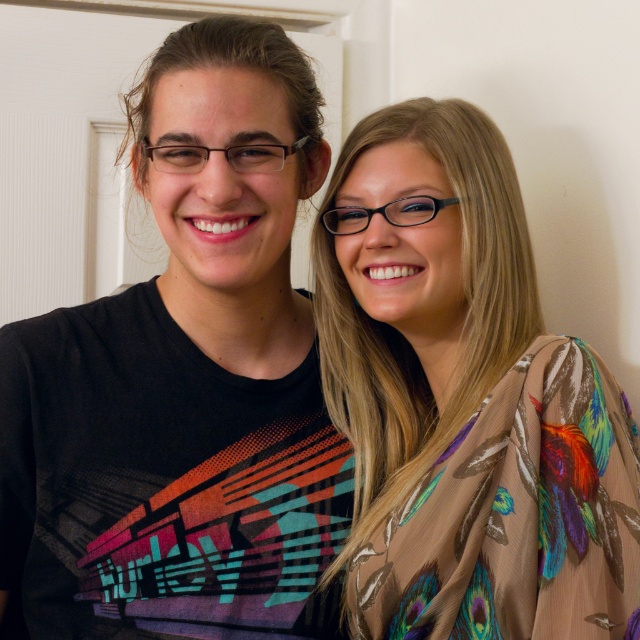
Question: In this image, where is black matte t-shirt at left located relative to multicolored feathered scarf at center?

Choices:
 (A) above
 (B) below

Answer: (A)

Question: Which object is closer to the camera taking this photo?

Choices:
 (A) black matte t-shirt at left
 (B) multicolored feathered scarf at center

Answer: (B)

Question: From the image, what is the correct spatial relationship of black matte t-shirt at left in relation to multicolored feathered scarf at center?

Choices:
 (A) above
 (B) below

Answer: (A)

Question: Is black matte t-shirt at left below multicolored feathered scarf at center?

Choices:
 (A) no
 (B) yes

Answer: (A)